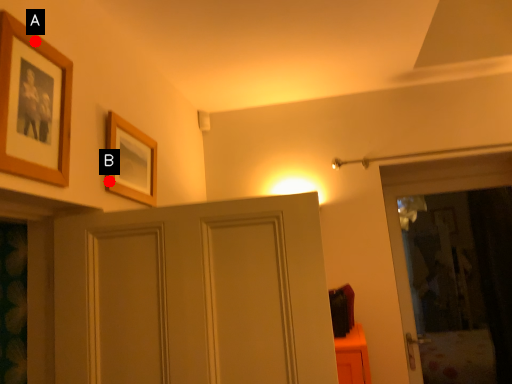
Question: Two points are circled on the image, labeled by A and B beside each circle. Which point is closer to the camera?

Choices:
 (A) A is closer
 (B) B is closer

Answer: (A)